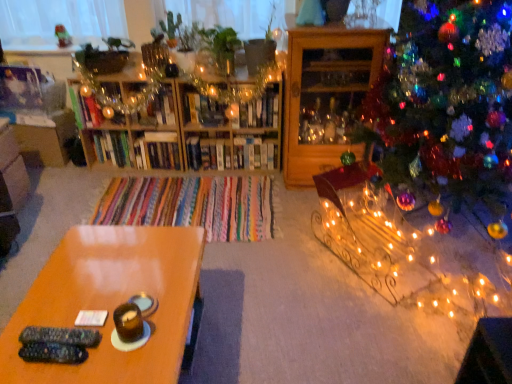
Where is `free spot in front of wooden bookshelf at center, the third shelf when ordered from right to left`? The image size is (512, 384). free spot in front of wooden bookshelf at center, the third shelf when ordered from right to left is located at coordinates (224, 190).